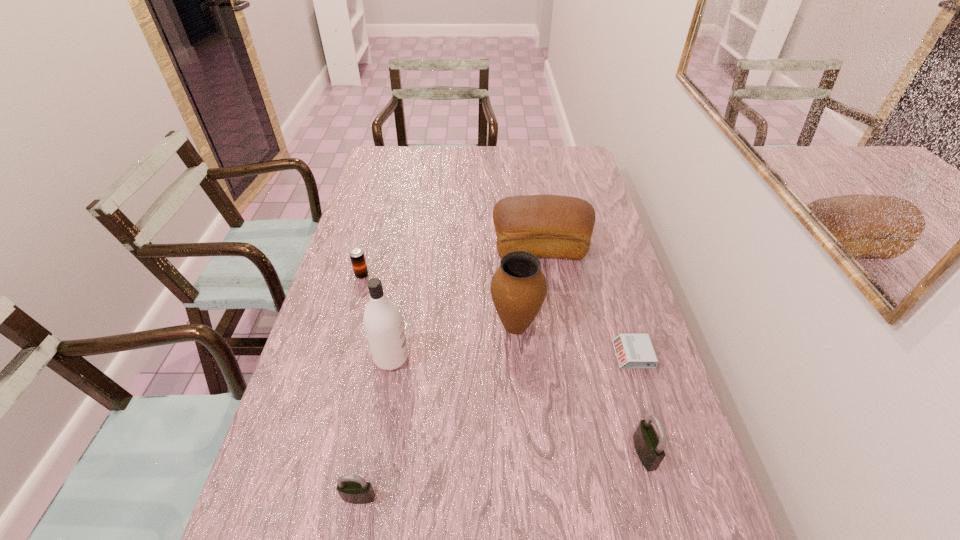
Please point a location where one more padlock can be added evenly. Please provide its 2D coordinates. Your answer should be formatted as a tuple, i.e. [(x, y)], where the tuple contains the x and y coordinates of a point satisfying the conditions above.

[(507, 474)]